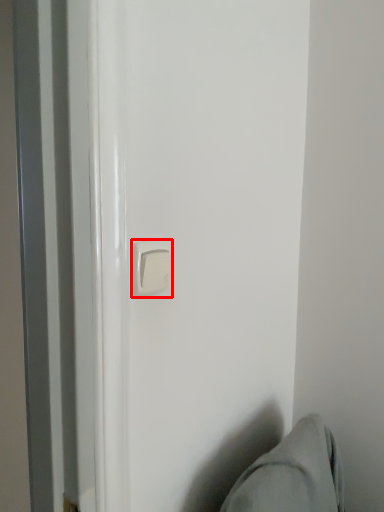
Question: From the image's perspective, where is door handle (annotated by the red box) located in relation to swivel chair in the image?

Choices:
 (A) above
 (B) below

Answer: (A)